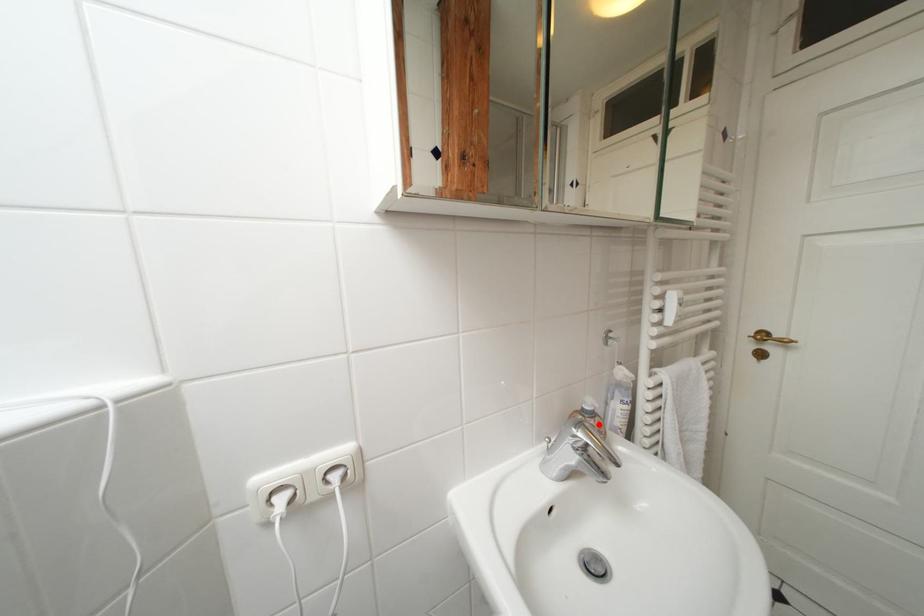
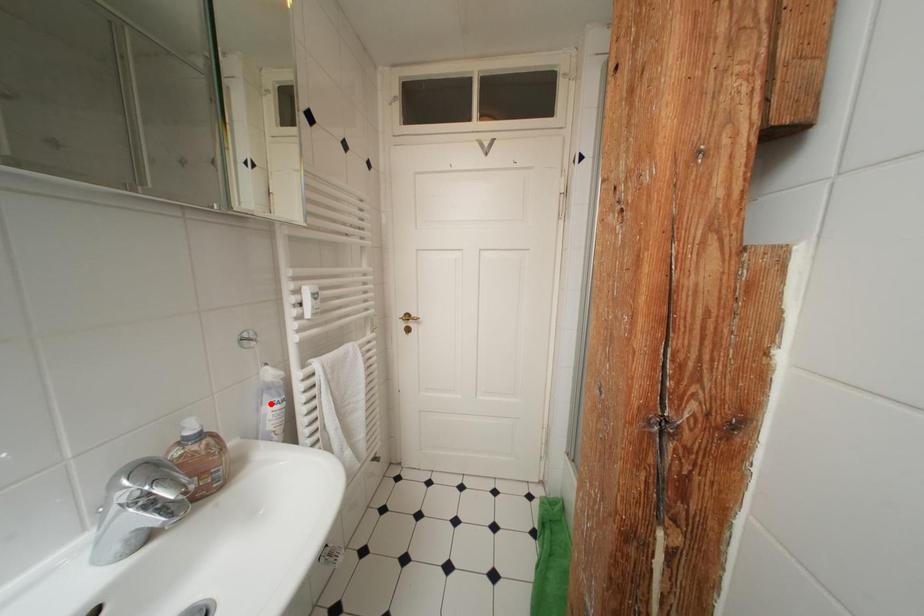
I am providing you with two images of the same scene from different viewpoints. A red point is marked on the first image and another point is marked on the second image. Are the points marked in image1 and image2 representing the same 3D position?

No